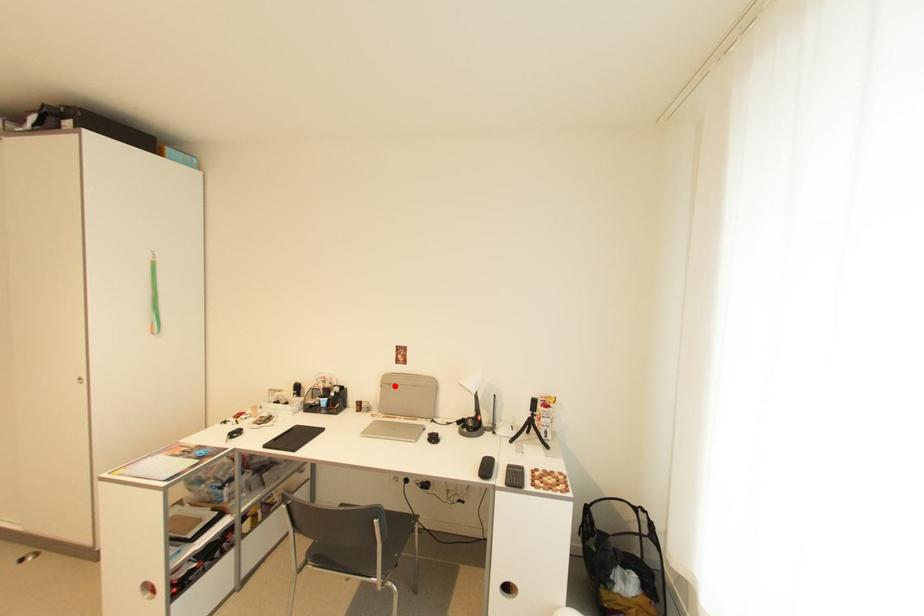
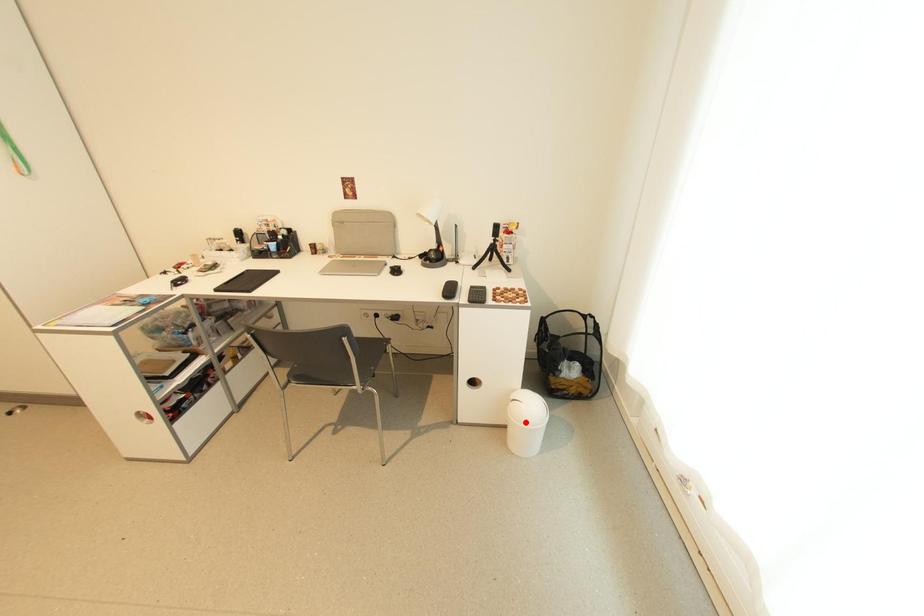
I am providing you with two images of the same scene from different viewpoints. A red point is marked on the first image and another point is marked on the second image. Is the red point in image1 aligned with the point shown in image2?

No